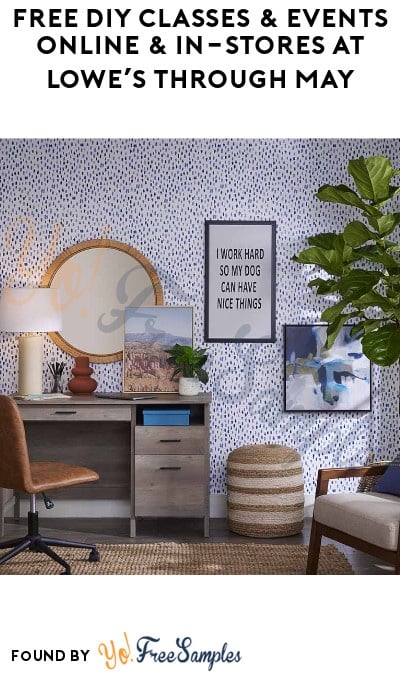
Locate an element on the screen. Image resolution: width=400 pixels, height=675 pixels. lamp shade is located at coordinates (29, 315).